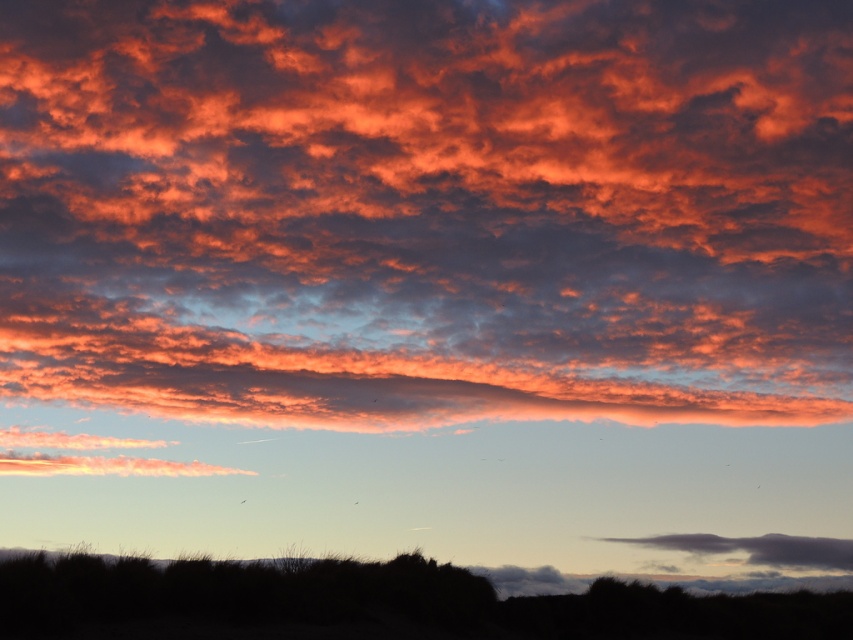
Who is more distant from viewer, (339, 218) or (735, 538)?

The point (735, 538) is more distant.

Between point (497, 342) and point (703, 552), which one is positioned in front?

Point (497, 342) is more forward.

At what (x,y) coordinates should I click in order to perform the action: click on cloudy sky at upper center. Please return your answer as a coordinate pair (x, y). The width and height of the screenshot is (853, 640). Looking at the image, I should click on (427, 211).

How much distance is there between cloudy sky at upper center and silhouette grass at lower center?

cloudy sky at upper center is 18.48 feet away from silhouette grass at lower center.

Who is higher up, cloudy sky at upper center or silhouette grass at lower center?

Positioned higher is cloudy sky at upper center.

This screenshot has height=640, width=853. I want to click on cloudy sky at upper center, so click(x=427, y=211).

Is point (476, 634) more distant than point (785, 563)?

No, (476, 634) is in front of (785, 563).

Does silhouette grass at lower center have a greater width compared to dark gray cloud at lower right?

No, silhouette grass at lower center is not wider than dark gray cloud at lower right.

Between point (79, 593) and point (633, 544), which one is positioned in front?

Point (79, 593) is more forward.

This screenshot has width=853, height=640. Find the location of `silhouette grass at lower center`. silhouette grass at lower center is located at coordinates (374, 604).